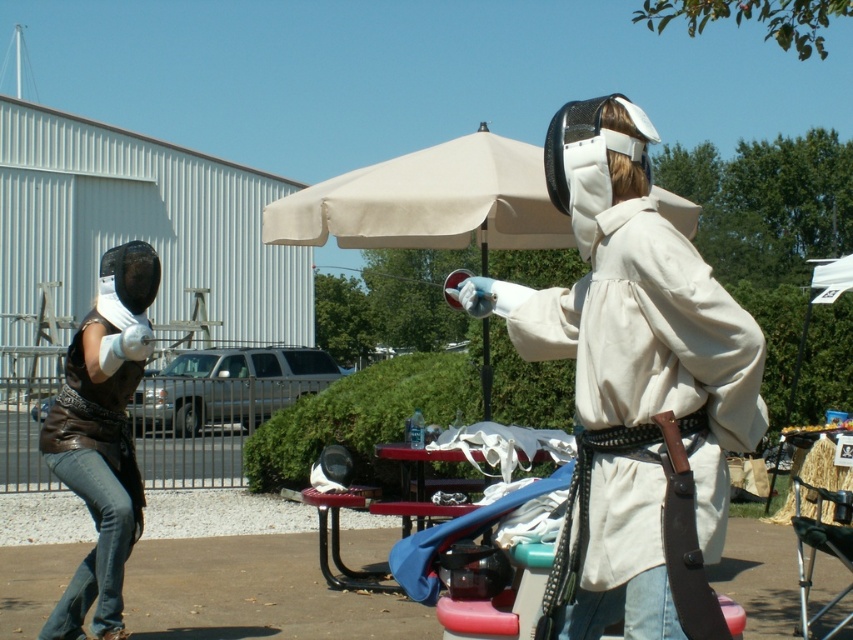
Between point (718, 387) and point (129, 374), which one is positioned in front?

Point (718, 387) is more forward.

Locate an element on the screen. The image size is (853, 640). white matte fencing mask at center is located at coordinates [631, 380].

Is point (648, 445) positioned after point (109, 476)?

No, it is not.

Image resolution: width=853 pixels, height=640 pixels. I want to click on white matte fencing mask at center, so click(631, 380).

Who is more forward, [511,216] or [141,372]?

Point [141,372]

Is beige fabric umbrella at center below brown leather vest at left?

Actually, beige fabric umbrella at center is above brown leather vest at left.

Locate an element on the screen. beige fabric umbrella at center is located at coordinates (428, 202).

Which of these two, white matte fencing mask at center or beige fabric umbrella at center, stands shorter?

white matte fencing mask at center is shorter.

Who is more forward, (573, 344) or (489, 248)?

Point (573, 344)

Describe the element at coordinates (631, 380) in the screenshot. I see `white matte fencing mask at center` at that location.

Where is `white matte fencing mask at center`? The height and width of the screenshot is (640, 853). white matte fencing mask at center is located at coordinates (631, 380).